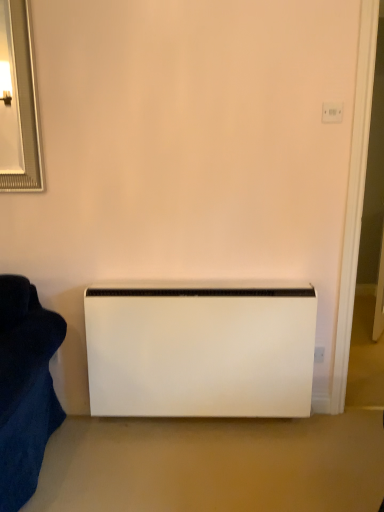
Question: Is white plastic electric outlet at upper right taller than white matte heater at center?

Choices:
 (A) no
 (B) yes

Answer: (A)

Question: Are white plastic electric outlet at upper right and white matte heater at center far apart?

Choices:
 (A) no
 (B) yes

Answer: (B)

Question: From a real-world perspective, does white plastic electric outlet at upper right stand above white matte heater at center?

Choices:
 (A) yes
 (B) no

Answer: (A)

Question: Is white plastic electric outlet at upper right facing away from white matte heater at center?

Choices:
 (A) yes
 (B) no

Answer: (B)

Question: Considering the relative positions of white plastic electric outlet at upper right and white matte heater at center in the image provided, is white plastic electric outlet at upper right behind white matte heater at center?

Choices:
 (A) no
 (B) yes

Answer: (A)

Question: From a real-world perspective, is white plastic electric outlet at upper right below white matte heater at center?

Choices:
 (A) no
 (B) yes

Answer: (A)

Question: Considering the relative sizes of white matte heater at center and white plastic electric outlet at upper right in the image provided, is white matte heater at center wider than white plastic electric outlet at upper right?

Choices:
 (A) yes
 (B) no

Answer: (A)

Question: Does white matte heater at center have a lesser width compared to white plastic electric outlet at upper right?

Choices:
 (A) no
 (B) yes

Answer: (A)

Question: Is white matte heater at center further to the viewer compared to white plastic electric outlet at upper right?

Choices:
 (A) no
 (B) yes

Answer: (B)

Question: Is white matte heater at center located outside white plastic electric outlet at upper right?

Choices:
 (A) yes
 (B) no

Answer: (A)

Question: Is white plastic electric outlet at upper right at the back of white matte heater at center?

Choices:
 (A) yes
 (B) no

Answer: (B)

Question: Considering the relative sizes of white matte heater at center and white plastic electric outlet at upper right in the image provided, is white matte heater at center bigger than white plastic electric outlet at upper right?

Choices:
 (A) yes
 (B) no

Answer: (A)

Question: Visually, is white plastic electric outlet at upper right positioned to the left or to the right of white matte heater at center?

Choices:
 (A) left
 (B) right

Answer: (B)